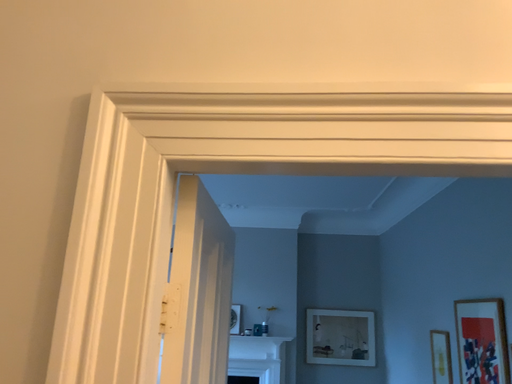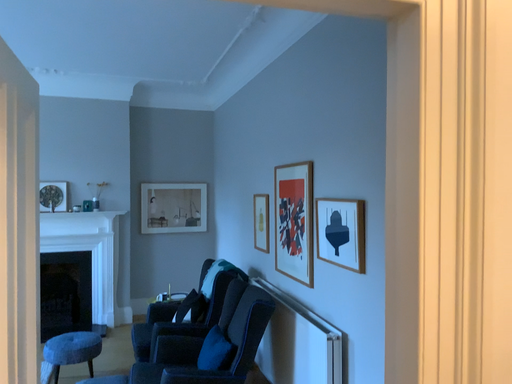
Question: Which way did the camera rotate in the video?

Choices:
 (A) rotated upward
 (B) rotated downward

Answer: (B)